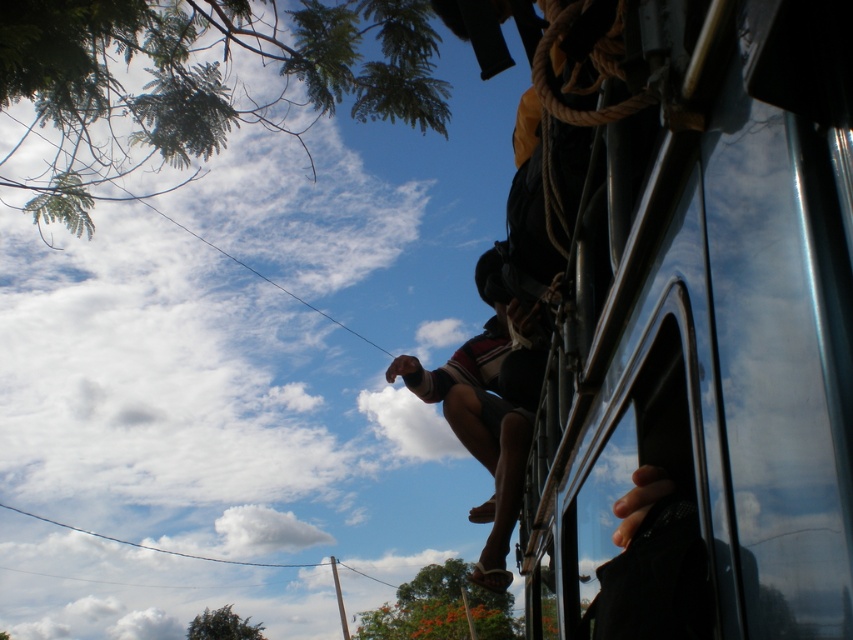
Question: Is metallic silver bus at upper right below dark red fabric shorts at center?

Choices:
 (A) no
 (B) yes

Answer: (A)

Question: Which point is farther from the camera taking this photo?

Choices:
 (A) tap(608, 524)
 (B) tap(524, 378)

Answer: (B)

Question: Which point is closer to the camera taking this photo?

Choices:
 (A) (544, 349)
 (B) (822, 83)

Answer: (B)

Question: Can you confirm if metallic silver bus at upper right is positioned above dark red fabric shorts at center?

Choices:
 (A) yes
 (B) no

Answer: (A)

Question: Where is metallic silver bus at upper right located in relation to dark red fabric shorts at center in the image?

Choices:
 (A) left
 (B) right

Answer: (B)